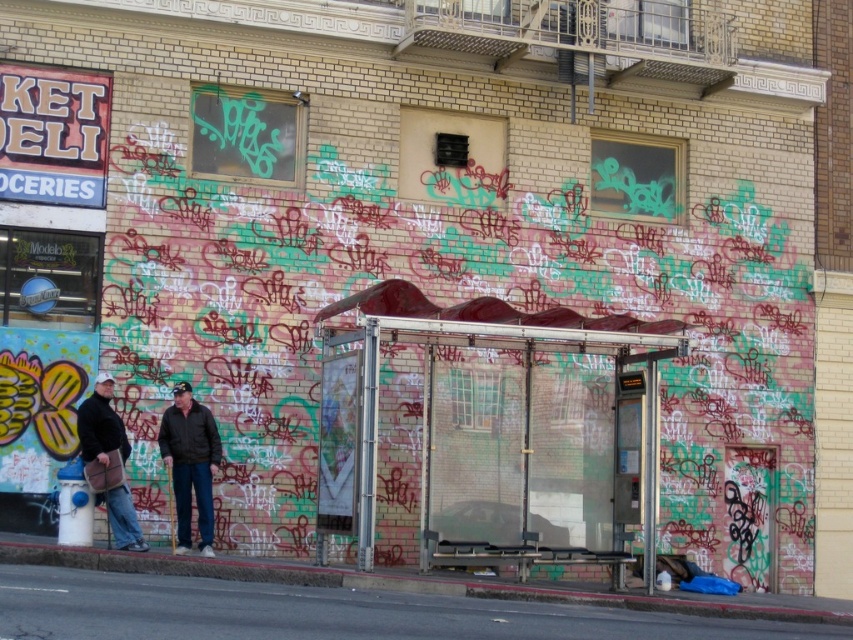
Between dark brown leather jacket at center and dark brown leather jacket at left, which one appears on the right side from the viewer's perspective?

Positioned to the right is dark brown leather jacket at center.

Can you confirm if dark brown leather jacket at center is positioned to the left of dark brown leather jacket at left?

No, dark brown leather jacket at center is not to the left of dark brown leather jacket at left.

Does point (190, 451) lie in front of point (102, 428)?

No.

Find the location of `dark brown leather jacket at center`. dark brown leather jacket at center is located at coordinates (190, 464).

Is transparent glass bus stop at center wider than dark brown leather jacket at center?

Correct, the width of transparent glass bus stop at center exceeds that of dark brown leather jacket at center.

Is transparent glass bus stop at center thinner than dark brown leather jacket at center?

In fact, transparent glass bus stop at center might be wider than dark brown leather jacket at center.

This screenshot has width=853, height=640. What do you see at coordinates (495, 429) in the screenshot?
I see `transparent glass bus stop at center` at bounding box center [495, 429].

You are a GUI agent. You are given a task and a screenshot of the screen. Output one action in this format:
    pyautogui.click(x=<x>, y=<y>)
    Task: Click on the transparent glass bus stop at center
    
    Given the screenshot: What is the action you would take?
    pyautogui.click(x=495, y=429)

Is the position of transparent glass bus stop at center more distant than that of dark brown leather jacket at left?

No, it is not.

In the scene shown: Between transparent glass bus stop at center and dark brown leather jacket at left, which one is positioned higher?

Positioned higher is transparent glass bus stop at center.

Which is behind, point (520, 417) or point (93, 406)?

The point (520, 417) is behind.

The width and height of the screenshot is (853, 640). Find the location of `transparent glass bus stop at center`. transparent glass bus stop at center is located at coordinates (495, 429).